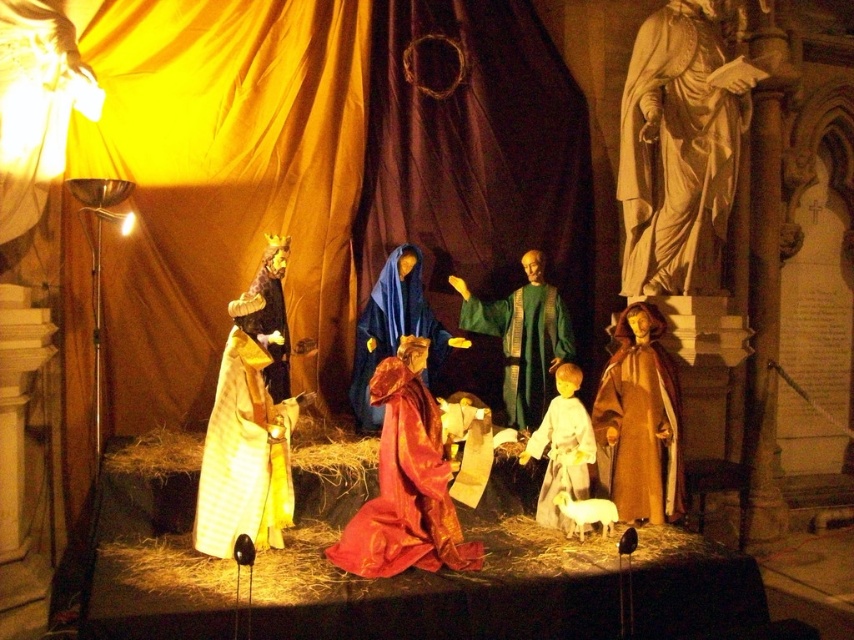
You are an observer standing in front of the nativity scene. You notice the shiny red fabric at center and the velvet blue robe at center. Which object is closer to you?

The shiny red fabric at center is closer to you because it is in front of the velvet blue robe at center.

In the nativity scene, you see two figures wearing a gold textured fabric robe at left and a green matte robe at center. Which figure is standing taller?

The gold textured fabric robe at left is taller than the green matte robe at center.